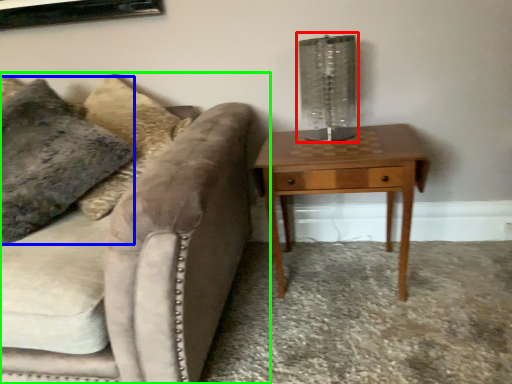
Question: Which is nearer to the table lamp (highlighted by a red box)? pillow (highlighted by a blue box) or studio couch (highlighted by a green box).

Choices:
 (A) pillow
 (B) studio couch

Answer: (B)